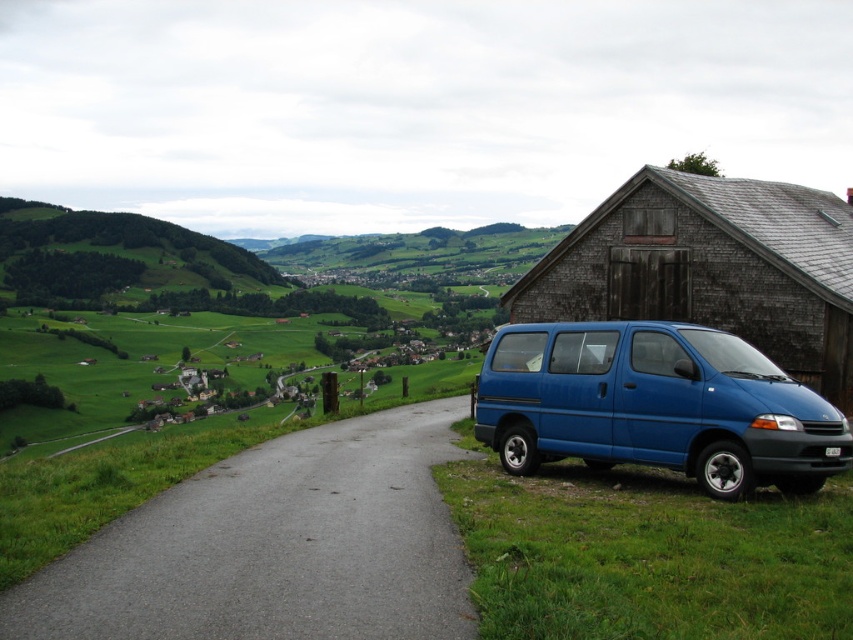
You are a traveler approaching the village along the road. You see the blue matte van at lower right and the wooden barn at right. Which object is nearer to you as you walk towards the village?

The blue matte van at lower right is closer to the viewer than the wooden barn at right, so the van is nearer to you as you walk towards the village.

You are driving a delivery truck that is 10 meters long. You need to turn your truck around in the space between the gray asphalt road at center and the wooden barn at right. Can you safely perform the maneuver without hitting any obstacles?

The distance between the gray asphalt road at center and the wooden barn at right is 10.95 meters. Since your truck is 10 meters long, there is sufficient space to turn around safely without hitting any obstacles.

In the scene shown: You are a delivery driver who needs to park your truck next to the blue matte van at lower right and the wooden barn at right. Based on the scene, which of the two objects is narrower, allowing your truck to fit better?

The blue matte van at lower right is thinner than the wooden barn at right, so it is narrower and would allow the truck to fit better.